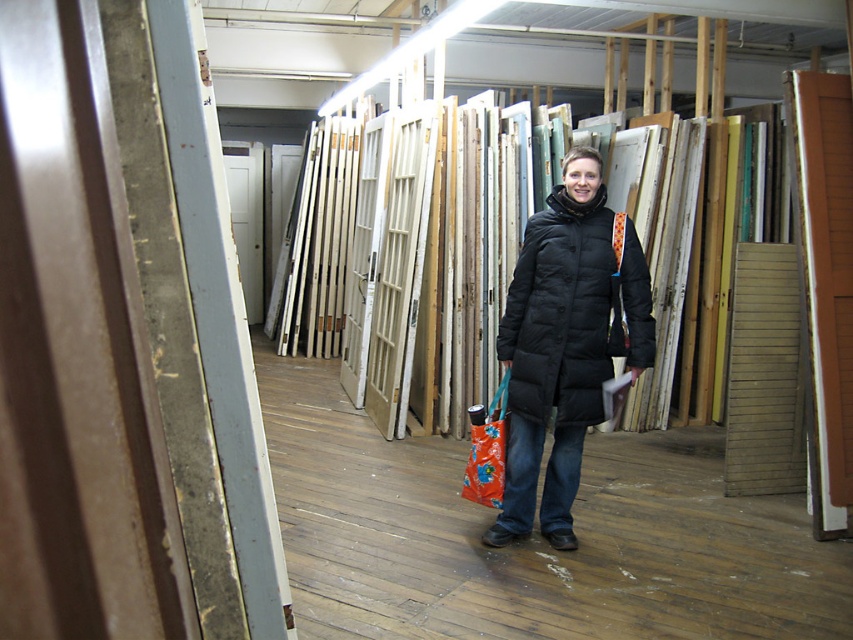
You are trying to reach the orange fabric shopping bag at center to pick it up. Is the black quilted coat at center blocking your access to it?

The black quilted coat at center is positioned over orange fabric shopping bag at center, so yes, the coat is blocking access to the bag.

You are a fashion designer observing the scene. You need to place a mannequin between the black quilted coat at center and the orange fabric shopping bag at center. Which item should the mannequin be placed closer to if you want it to be proportionally sized to the items?

The mannequin should be placed closer to the orange fabric shopping bag at center because the black quilted coat at center is much taller, so the mannequin needs to be closer to the shorter item to maintain proportional sizing.